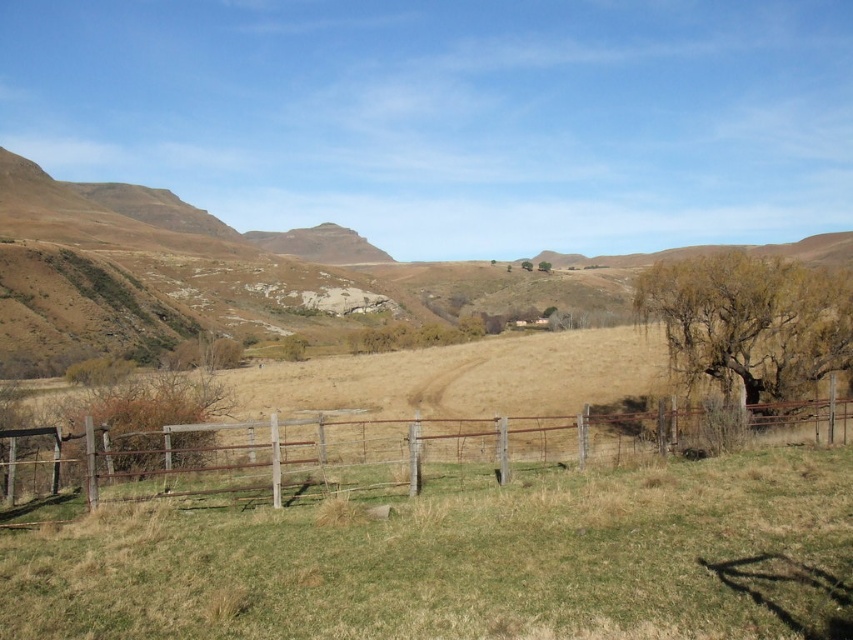
Question: Does green grassy field at center appear on the right side of rusty wood fence at lower center?

Choices:
 (A) no
 (B) yes

Answer: (B)

Question: Which of the following is the closest to the observer?

Choices:
 (A) (172, 593)
 (B) (160, 490)

Answer: (A)

Question: Among these points, which one is farthest from the camera?

Choices:
 (A) (416, 420)
 (B) (421, 611)

Answer: (A)

Question: Does green grassy field at center appear under rusty wood fence at lower center?

Choices:
 (A) no
 (B) yes

Answer: (A)

Question: Which point is farther to the camera?

Choices:
 (A) (312, 636)
 (B) (717, 416)

Answer: (B)

Question: Is green grassy field at center thinner than rusty wood fence at lower center?

Choices:
 (A) yes
 (B) no

Answer: (A)